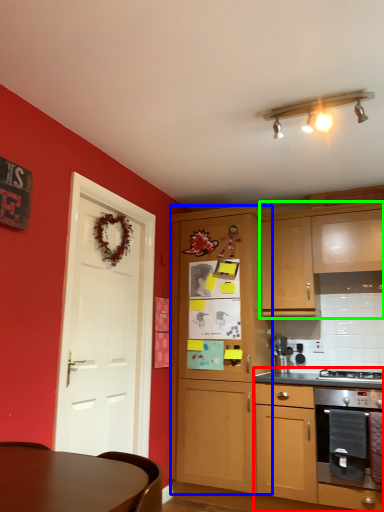
Question: Considering the real-world distances, which object is closest to cabinetry (highlighted by a red box)? cabinetry (highlighted by a blue box) or cabinetry (highlighted by a green box).

Choices:
 (A) cabinetry
 (B) cabinetry

Answer: (A)